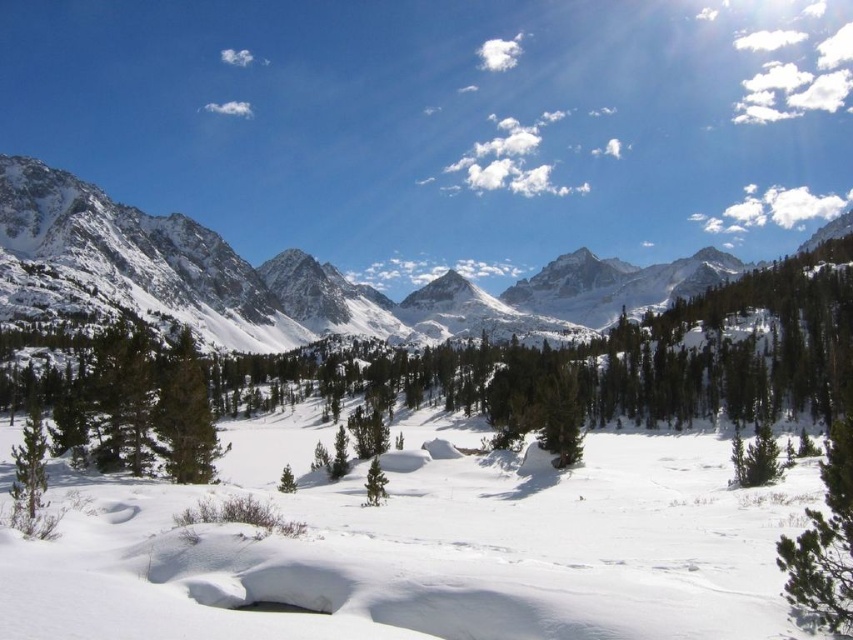
Describe the element at coordinates (426, 548) in the screenshot. I see `white fluffy snow at center` at that location.

Find the location of a particular element. The width and height of the screenshot is (853, 640). white fluffy snow at center is located at coordinates (426, 548).

Locate an element on the screen. white fluffy snow at center is located at coordinates (426, 548).